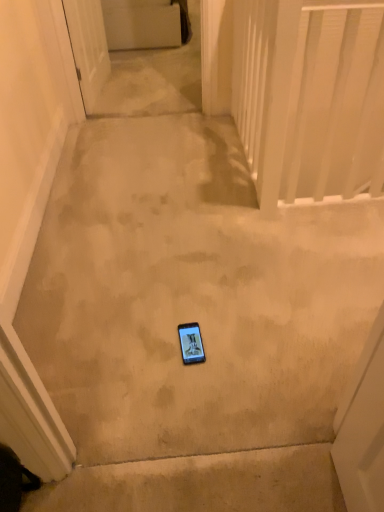
Where is `vacant space behind white glossy door at upper left`? This screenshot has width=384, height=512. vacant space behind white glossy door at upper left is located at coordinates (134, 65).